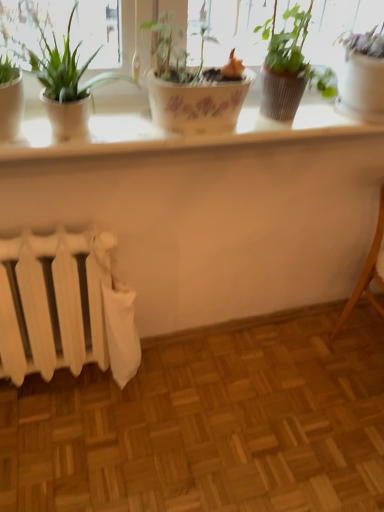
Locate an element on the screen. This screenshot has width=384, height=512. vacant area that lies between light brown wooden chair at lower right and white matte radiator at lower left is located at coordinates (x=251, y=364).